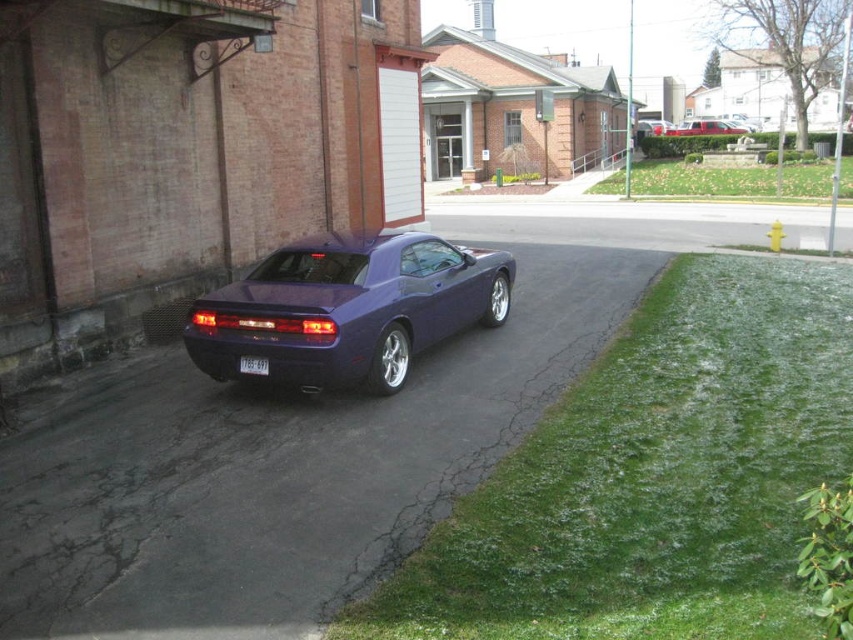
Question: Does metallic red truck at upper right appear over metallic purple car at center?

Choices:
 (A) yes
 (B) no

Answer: (A)

Question: Is glossy metallic sedan at center to the left of metallic red truck at upper right from the viewer's perspective?

Choices:
 (A) yes
 (B) no

Answer: (A)

Question: Which point is farther to the camera?

Choices:
 (A) (3, 464)
 (B) (254, 362)
 (C) (480, 323)

Answer: (C)

Question: Estimate the real-world distances between objects in this image. Which object is closer to the metallic red truck at upper right?

Choices:
 (A) glossy metallic sedan at center
 (B) glossy metallic car at center
 (C) metallic purple car at center
 (D) white plastic license plate at center

Answer: (C)

Question: Can you confirm if metallic red truck at upper right is wider than metallic purple car at center?

Choices:
 (A) yes
 (B) no

Answer: (A)

Question: Which of the following is the closest to the observer?

Choices:
 (A) glossy metallic car at center
 (B) metallic red truck at upper right
 (C) glossy metallic sedan at center
 (D) white plastic license plate at center

Answer: (A)